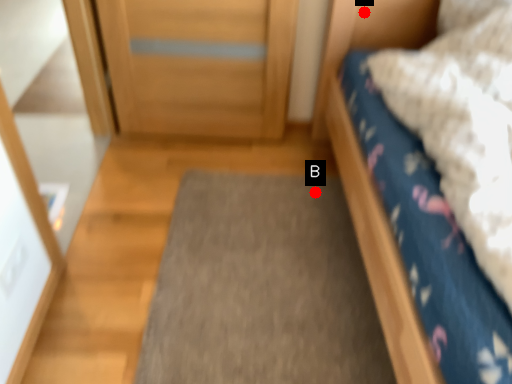
Question: Two points are circled on the image, labeled by A and B beside each circle. Which point is closer to the camera?

Choices:
 (A) A is closer
 (B) B is closer

Answer: (A)